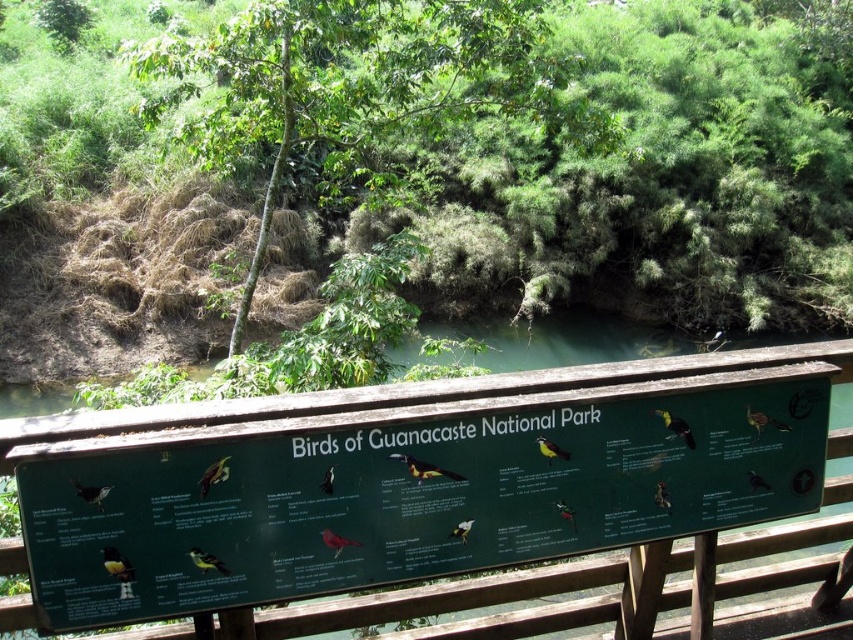
Looking at this image, you are a park ranger standing on the wooden bridge and need to place a new 2.5 meter long fence between the green matte signboard at center and the green leafy tree at upper center. Is there enough space between them to install the fence?

The distance between the green matte signboard at center and the green leafy tree at upper center is 8.60 meters. Since the fence is only 2.5 meters long, there is sufficient space to install it between them.

You are a park visitor who wants to take a photo of the green leafy tree at upper center. However, there is a green matte signboard at center in the way. Based on their positions, can you determine if the signboard is blocking your view of the tree?

The green matte signboard at center is to the right of the green leafy tree at upper center, so the signboard is positioned to the right of the tree. This means the signboard is not directly in front of the tree but rather to its right side, so you can move to the left of the signboard to get an unobstructed view of the tree.